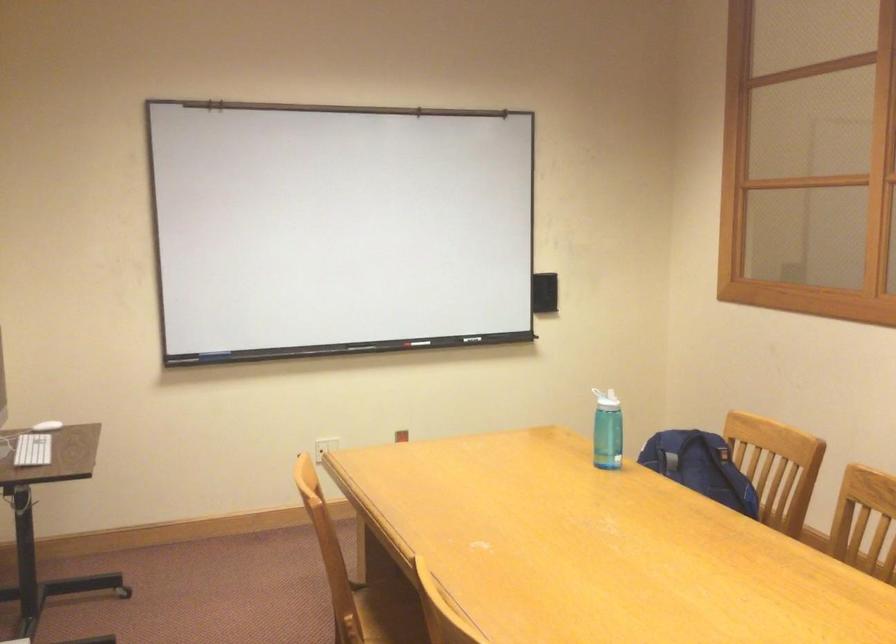
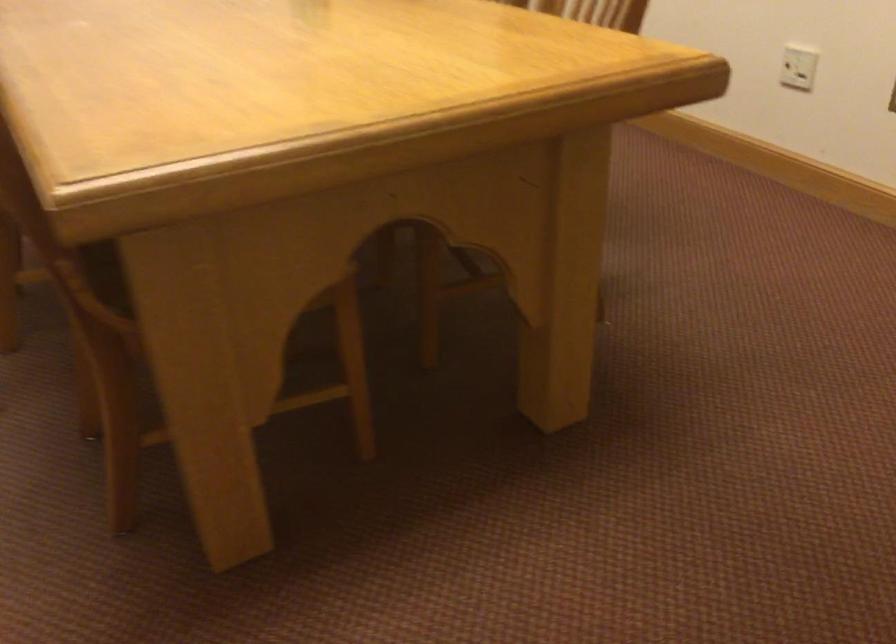
Question: The images are taken continuously from a first-person perspective. In which direction is your viewpoint rotating?

Choices:
 (A) Left
 (B) Right
 (C) Up
 (D) Down

Answer: (D)